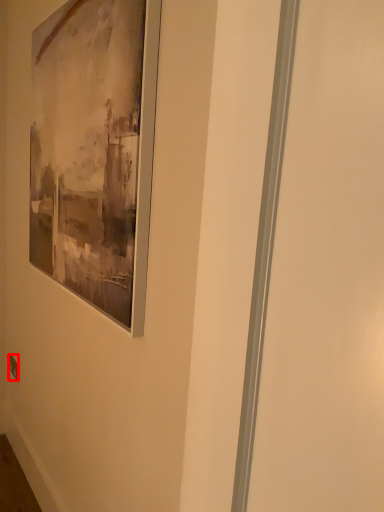
Question: Where is electric outlet (annotated by the red box) located in relation to picture frame in the image?

Choices:
 (A) left
 (B) right

Answer: (A)